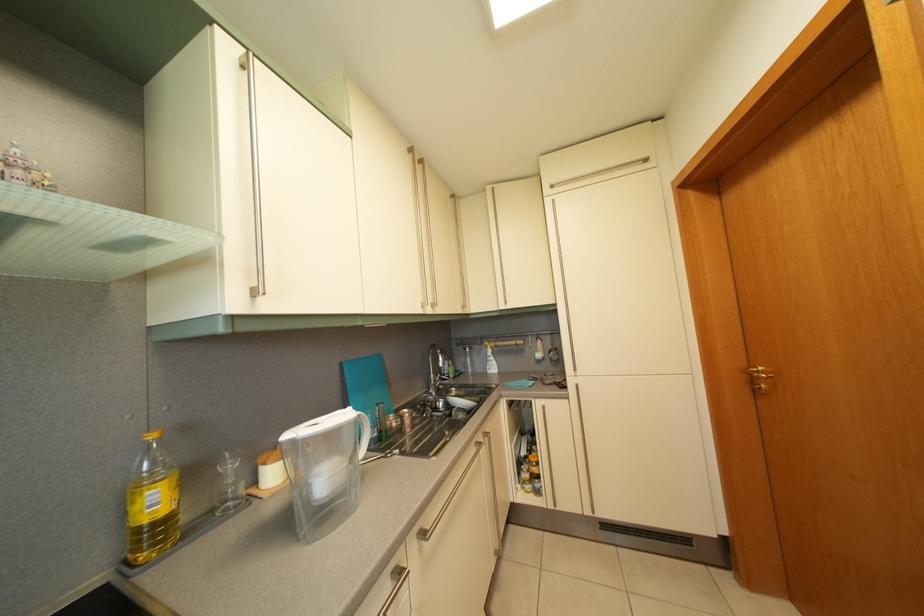
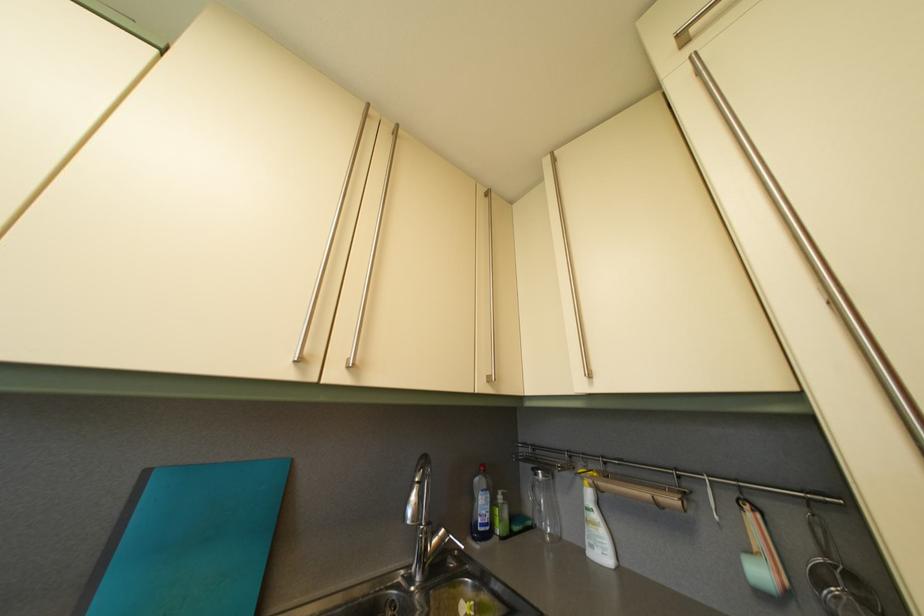
Locate, in the second image, the point that corresponds to point 494,354 in the first image.

(590, 485)